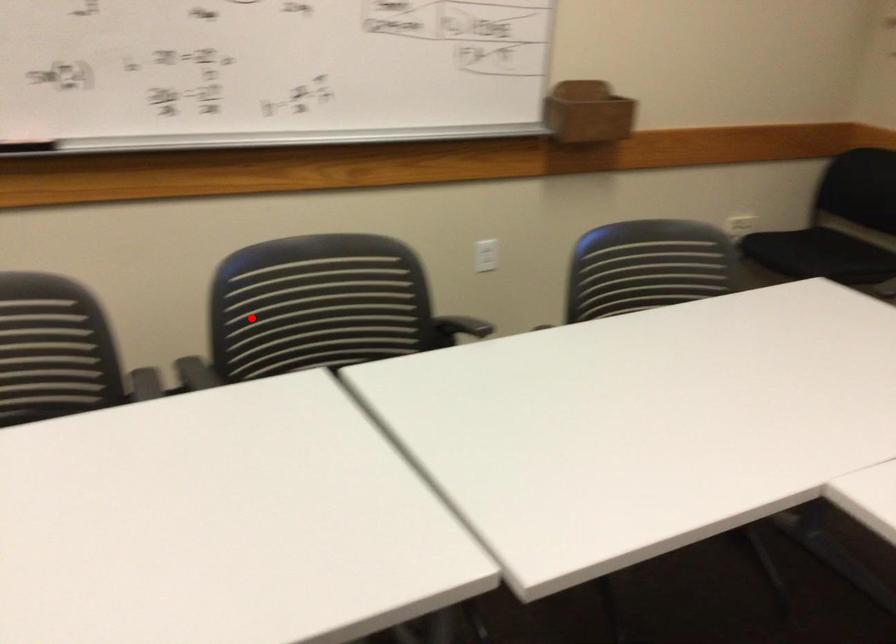
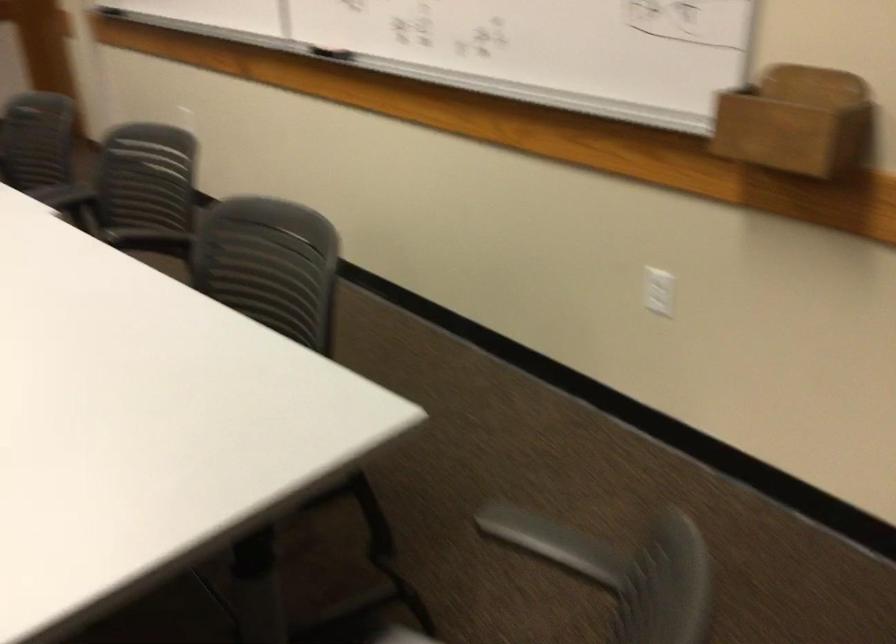
Question: A red point is marked in image1. In image2, is the corresponding 3D point closer to the camera or farther? Reply with the corresponding letter.

Choices:
 (A) The corresponding 3D point is closer.
 (B) The corresponding 3D point is farther.

Answer: (B)